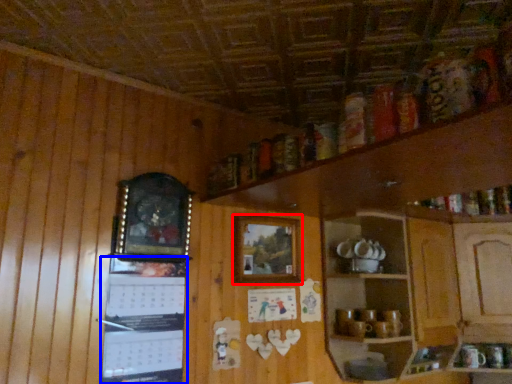
Question: Which point is closer to the camera, picture frame (highlighted by a red box) or bulletin board (highlighted by a blue box)?

Choices:
 (A) picture frame
 (B) bulletin board

Answer: (B)